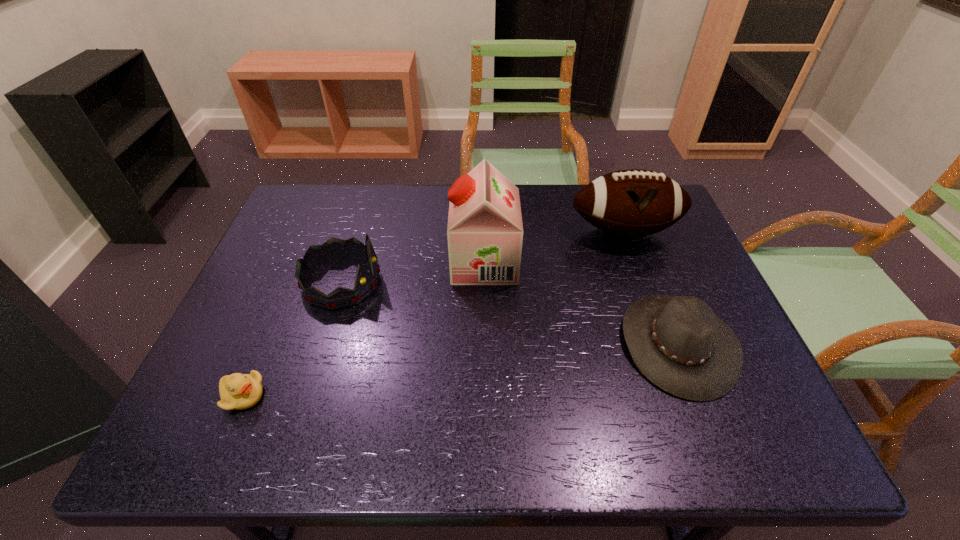
Image resolution: width=960 pixels, height=540 pixels. What are the coordinates of `free location located 0.300m at the front of the tiara with jewels` in the screenshot? It's located at (496, 282).

Where is `free space located on the front-facing side of the hat`? The image size is (960, 540). free space located on the front-facing side of the hat is located at coordinates (535, 344).

Where is `free region located 0.300m on the front-facing side of the hat`? The image size is (960, 540). free region located 0.300m on the front-facing side of the hat is located at coordinates (492, 344).

The height and width of the screenshot is (540, 960). Find the location of `free space located on the front-facing side of the hat`. free space located on the front-facing side of the hat is located at coordinates (574, 344).

Find the location of a particular element. blank space located on the beak of the duckling is located at coordinates (366, 396).

Identify the location of object present at the far edge. (630, 203).

Locate an element on the screen. This screenshot has width=960, height=540. object that is positioned at the near edge is located at coordinates (238, 391).

Where is `tiara that is at the left edge`? tiara that is at the left edge is located at coordinates (333, 249).

Where is `duckling that is at the left edge`? duckling that is at the left edge is located at coordinates (238, 391).

Identify the location of football (American) located at the right edge. (630, 203).